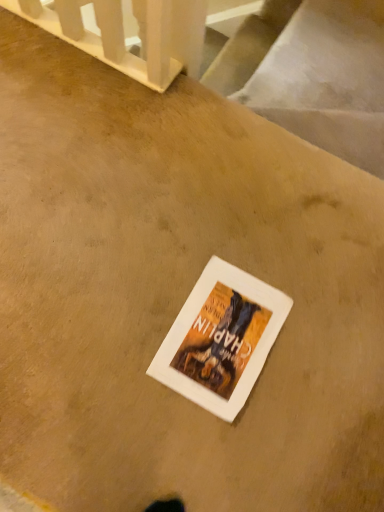
Identify the location of vacant space underneath white paper book at center (from a real-world perspective). (220, 330).